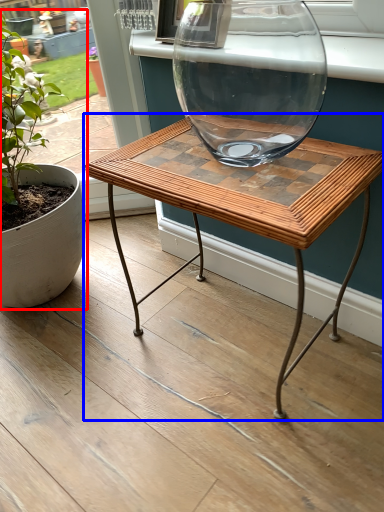
Question: Among these objects, which one is nearest to the camera, houseplant (highlighted by a red box) or coffee table (highlighted by a blue box)?

Choices:
 (A) houseplant
 (B) coffee table

Answer: (B)